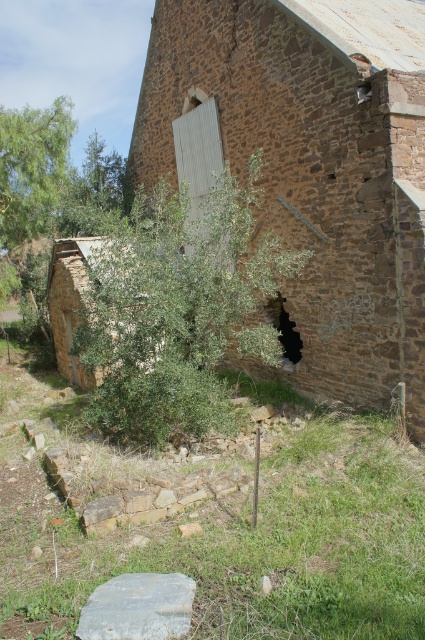
Which is in front, point (85, 301) or point (278, 314)?

Point (85, 301) is in front.

You are a GUI agent. You are given a task and a screenshot of the screen. Output one action in this format:
    pyautogui.click(x=<x>, y=<y>)
    Task: Click on the green leafy bush at center
    
    Given the screenshot: What is the action you would take?
    pyautogui.click(x=73, y=301)

Image resolution: width=425 pixels, height=640 pixels. Identify the location of green leafy bush at center. (73, 301).

Measure the distance between point (257, 193) and camera.

Point (257, 193) is 9.92 meters from camera.

Is point (221, 394) in front of point (297, 355)?

Yes, point (221, 394) is closer to viewer.

Is point (180, 275) positioned behind point (300, 339)?

No, it is not.

At what (x,y) coordinates should I click in order to perform the action: click on green leafy olive tree at center. Please return your answer as a coordinate pair (x, y). Looking at the image, I should click on (178, 308).

Is brown stone wall at center to the right of green leafy olive tree at center from the viewer's perspective?

Yes, brown stone wall at center is to the right of green leafy olive tree at center.

Does point (413, 60) lie behind point (193, 237)?

That is True.

The width and height of the screenshot is (425, 640). I want to click on brown stone wall at center, so coord(309,164).